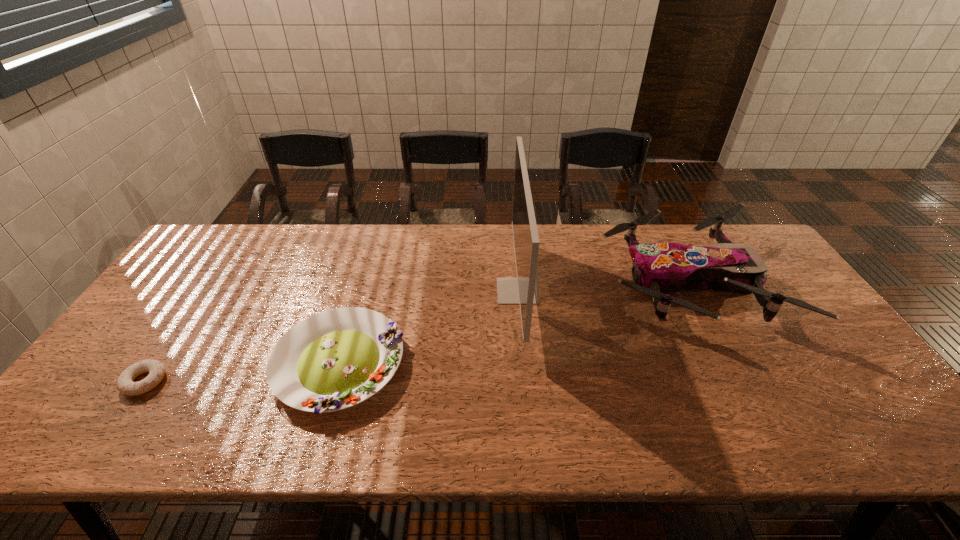
I want to click on object that is at the right edge, so click(x=657, y=268).

The height and width of the screenshot is (540, 960). In order to click on object located at the far right corner in this screenshot , I will do `click(657, 268)`.

Locate an element on the screen. vacant space at the far edge is located at coordinates (628, 252).

This screenshot has height=540, width=960. Identify the location of vacant space at the near edge of the desktop. (206, 429).

Image resolution: width=960 pixels, height=540 pixels. In order to click on vacant region at the right edge in this screenshot , I will do `click(802, 323)`.

I want to click on vacant space at the far left corner of the desktop, so click(x=258, y=230).

Find the location of a particular element. vacant space at the near left corner of the desktop is located at coordinates (118, 415).

The image size is (960, 540). What are the coordinates of `free space that is in between the doughnut and the second shortest object` in the screenshot? It's located at (242, 373).

This screenshot has width=960, height=540. In order to click on free space between the rightmost object and the third object from right to left in this screenshot , I will do `click(513, 323)`.

This screenshot has width=960, height=540. I want to click on blank region between the leftmost object and the third object from right to left, so click(242, 373).